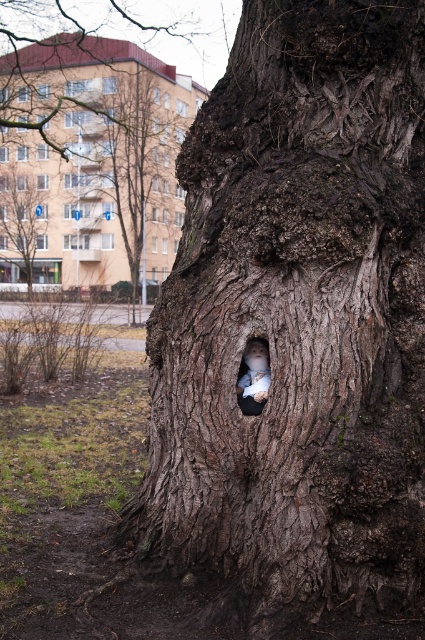
Question: Which point appears farthest from the camera in this image?

Choices:
 (A) (323, 538)
 (B) (44, 211)
 (C) (204, 28)
 (D) (133, 170)

Answer: (C)

Question: Is smooth bark tree at upper left positioned before white plush toy at center?

Choices:
 (A) no
 (B) yes

Answer: (A)

Question: Does smooth bark tree at center lie in front of white plush toy at center?

Choices:
 (A) yes
 (B) no

Answer: (B)

Question: Which object appears closest to the camera in this image?

Choices:
 (A) white fur face at center
 (B) dark brown rough bark at center
 (C) smooth bark tree at center

Answer: (B)

Question: Estimate the real-world distances between objects in this image. Which object is farther from the white plush toy at center?

Choices:
 (A) dark brown rough bark at center
 (B) dark brown rough bark at upper center
 (C) smooth bark tree at upper left
 (D) smooth bark tree at center

Answer: (B)

Question: Is smooth bark tree at center positioned in front of dark brown rough bark at upper center?

Choices:
 (A) no
 (B) yes

Answer: (B)